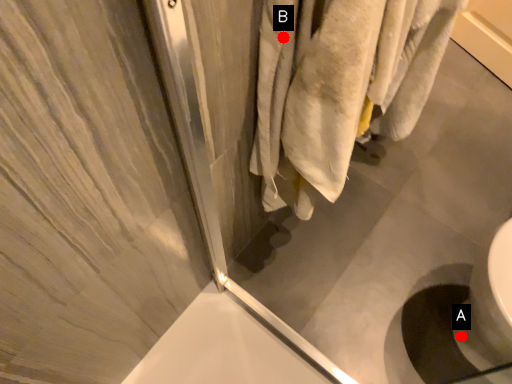
Question: Two points are circled on the image, labeled by A and B beside each circle. Which point appears farthest from the camera in this image?

Choices:
 (A) A is further
 (B) B is further

Answer: (A)